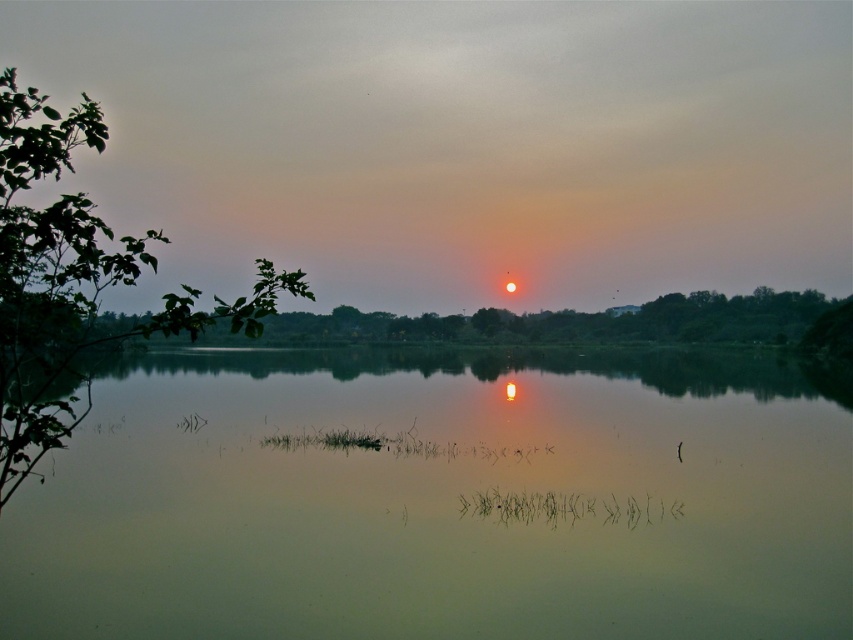
You are an artist trying to paint the sunset scene. You want to ensure the green leafy branch at left is visible in the painting. Since the smooth reflective water at center is in front of it, will the branch be visible through the water?

The green leafy branch at left is behind the smooth reflective water at center. Since the water is smooth and reflective, it may reflect the sky and sun but might not obscure the branch entirely. However, the branch might appear slightly distorted or less distinct through the water, depending on its transparency. To ensure visibility, focus on outlining the branch silhouette against the water or enhancing its contrast in the painting.

You are standing at the edge of the water and want to place a small floating decoration. The decoration requires at least 2 meters of clear water surface to float safely. Given the relationship between the smooth reflective water at center and the green leafy branch at left, can you determine if there is enough space for the decoration?

The smooth reflective water at center is not as tall as the green leafy branch at left, but the description does not provide specific measurements of their sizes or distances. Therefore, it is impossible to determine if there is enough space for the decoration based on the given information.

You are standing at the edge of the water and want to take a photo of the sunset reflection. Where should you position yourself to capture the reflection of the smooth reflective water at center?

You should position yourself at the edge of the water directly facing the point at coordinates [440,502] to capture the reflection of the smooth reflective water at center.